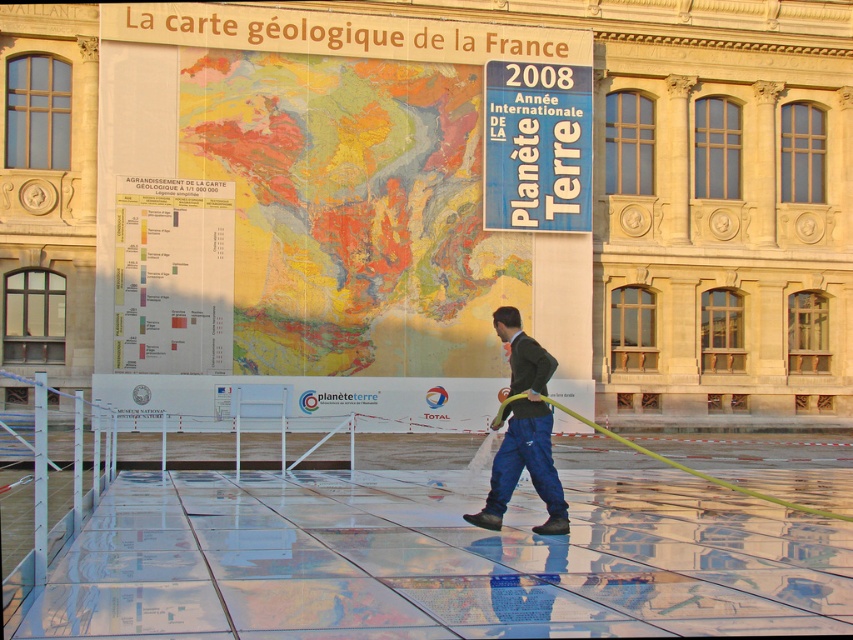
You are standing in front of the map of France and notice two items at the center of the scene. Which item is closer to you between the dark green sweater at center and the green rubber hose at center?

The dark green sweater at center is closer to you than the green rubber hose at center because it is further to the viewer.

You are an inspector checking the equipment in the scene. You notice a dark green sweater at center and a green rubber hose at center. Which object is positioned higher in the scene?

The dark green sweater at center is positioned above the green rubber hose at center, so it is higher in the scene.